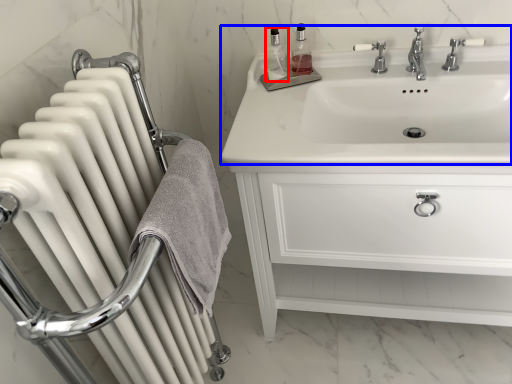
Question: Which object appears farthest to the camera in this image, toiletry (highlighted by a red box) or sink (highlighted by a blue box)?

Choices:
 (A) toiletry
 (B) sink

Answer: (A)